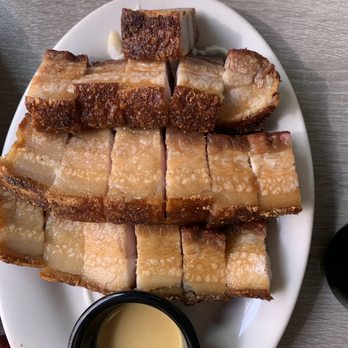
I want to click on bowl, so click(x=87, y=311).